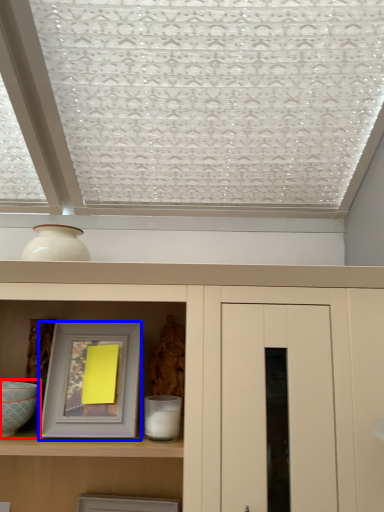
Question: Which point is closer to the camera, glass bowl (highlighted by a red box) or picture frame (highlighted by a blue box)?

Choices:
 (A) glass bowl
 (B) picture frame

Answer: (A)